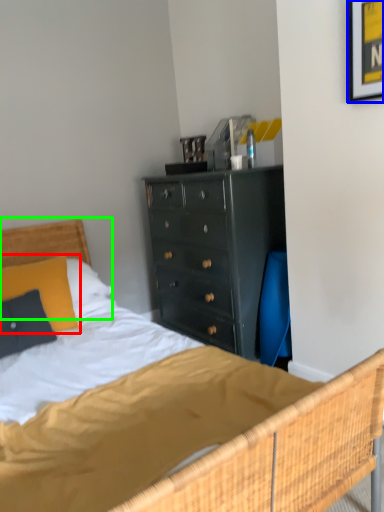
Question: Estimate the real-world distances between objects in this image. Which object is farther from pillow (highlighted by a red box), picture frame (highlighted by a blue box) or headboard (highlighted by a green box)?

Choices:
 (A) picture frame
 (B) headboard

Answer: (A)